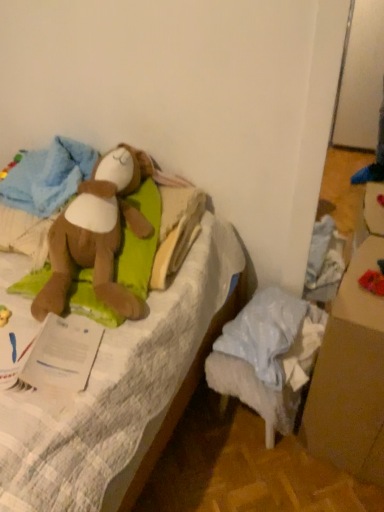
Question: Is brown cardboard box at lower right taller or shorter than red fabric toy at lower right, the first toy in the right-to-left sequence?

Choices:
 (A) short
 (B) tall

Answer: (B)

Question: Considering their positions, is brown cardboard box at lower right located in front of or behind red fabric toy at lower right, the first toy in the right-to-left sequence?

Choices:
 (A) behind
 (B) front

Answer: (B)

Question: Which is nearer to the brown plush toy at left, acting as the first toy starting from the left?

Choices:
 (A) brown plush toy at upper left
 (B) white paper at left
 (C) red fabric toy at lower right, arranged as the second toy when viewed from the left
 (D) brown cardboard box at lower right

Answer: (A)

Question: Which is nearer to the brown plush toy at upper left?

Choices:
 (A) white paper at left
 (B) red fabric toy at lower right, arranged as the second toy when viewed from the left
 (C) brown cardboard box at lower right
 (D) brown plush toy at left, acting as the first toy starting from the left

Answer: (D)